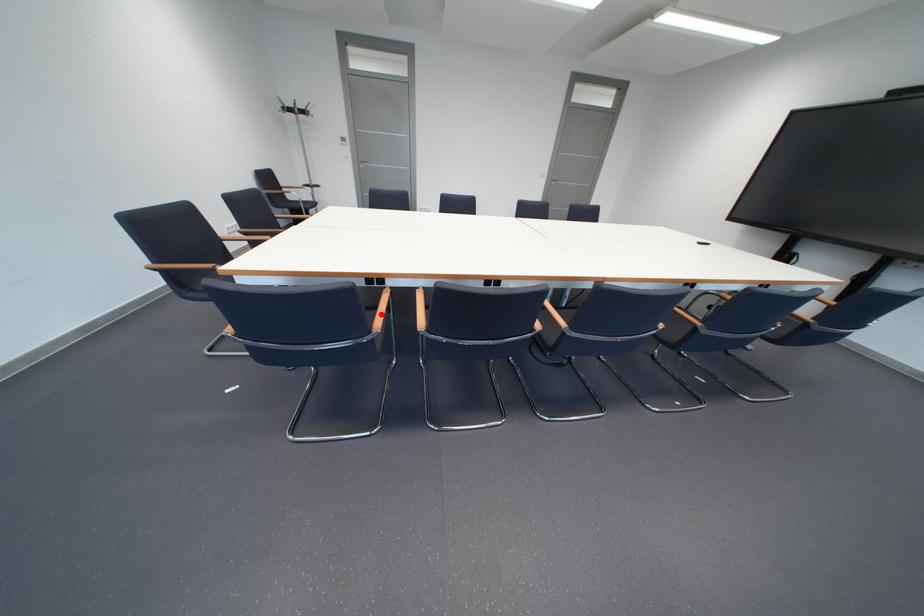
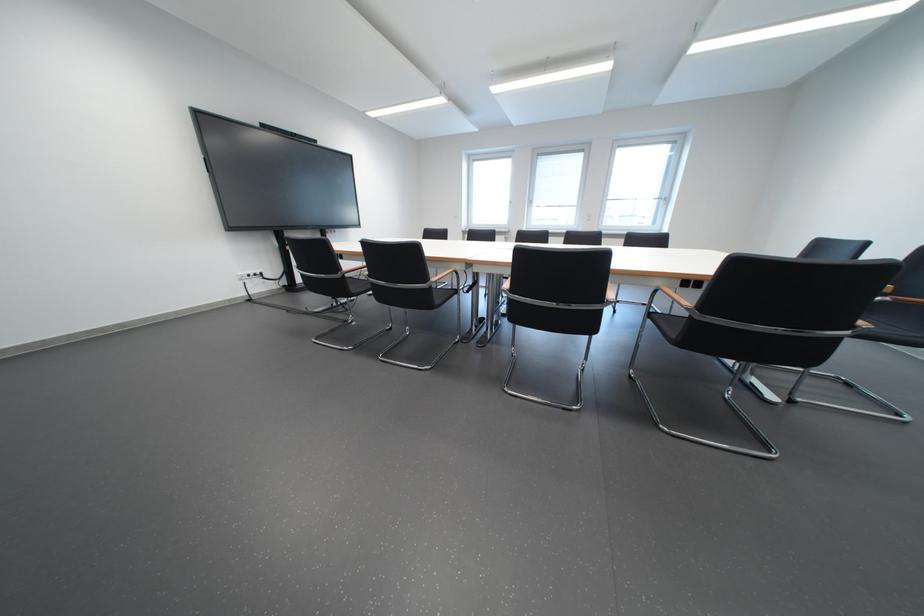
Question: I am providing you with two images of the same scene from different viewpoints. A red point is marked on the first image. At the location where the point appears in image 1, is it still visible in image 2?

Choices:
 (A) Yes
 (B) No

Answer: (B)